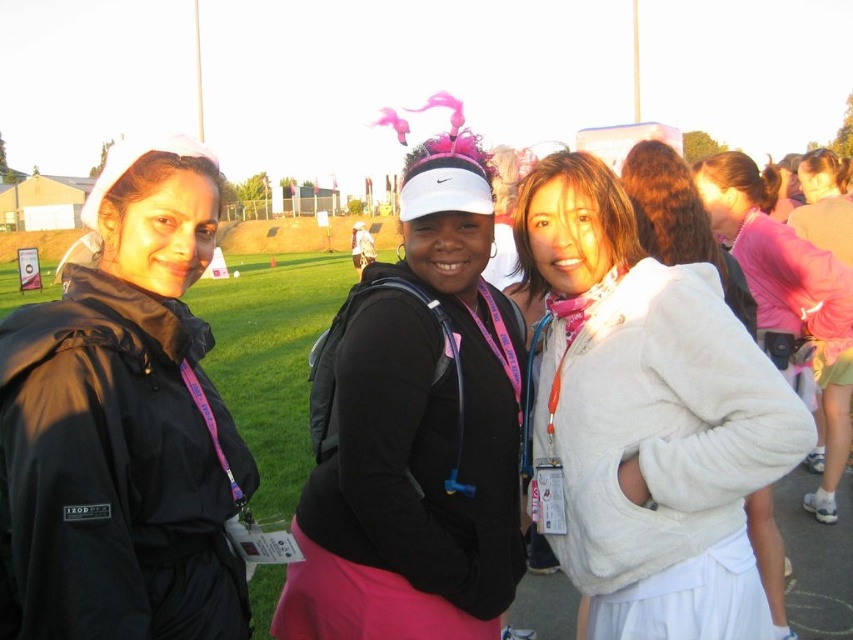
Question: Estimate the real-world distances between objects in this image. Which object is closer to the pink matte visor at center?

Choices:
 (A) black matte jacket at left
 (B) white fuzzy jacket at center

Answer: (B)

Question: Is black matte jacket at left thinner than white fuzzy jacket at center?

Choices:
 (A) no
 (B) yes

Answer: (B)

Question: Which point appears farthest from the camera in this image?

Choices:
 (A) (579, 536)
 (B) (84, 611)
 (C) (495, 378)

Answer: (C)

Question: Can you confirm if black matte jacket at left is smaller than pink matte visor at center?

Choices:
 (A) yes
 (B) no

Answer: (A)

Question: Which point is farther to the camera?

Choices:
 (A) (576, 406)
 (B) (114, 262)

Answer: (A)

Question: Is pink matte visor at center to the left of white fuzzy jacket at center from the viewer's perspective?

Choices:
 (A) no
 (B) yes

Answer: (B)